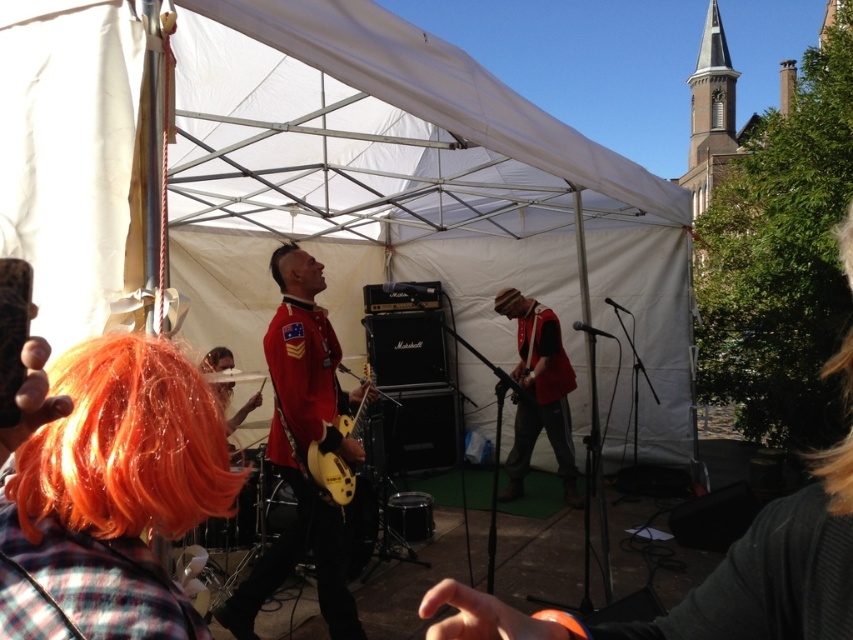
Consider the image. Can you confirm if shiny red uniform at center is positioned to the right of matte red vest at center?

In fact, shiny red uniform at center is to the left of matte red vest at center.

Consider the image. Can you confirm if shiny red uniform at center is thinner than matte red vest at center?

Incorrect, shiny red uniform at center's width is not less than matte red vest at center's.

Between point (322, 564) and point (532, 308), which one is positioned in front?

Point (322, 564)

Image resolution: width=853 pixels, height=640 pixels. Find the location of `shiny red uniform at center`. shiny red uniform at center is located at coordinates (302, 456).

Does orange synthetic wig at lower left have a lesser width compared to dark brown hair at center?

No.

Does orange synthetic wig at lower left have a larger size compared to dark brown hair at center?

Indeed, orange synthetic wig at lower left has a larger size compared to dark brown hair at center.

Is point (177, 442) less distant than point (277, 252)?

That is True.

The width and height of the screenshot is (853, 640). In order to click on orange synthetic wig at lower left in this screenshot , I will do `click(126, 445)`.

Consider the image. Between white fabric tent at center and orange synthetic wig at lower left, which one is positioned lower?

orange synthetic wig at lower left

Which of these two, white fabric tent at center or orange synthetic wig at lower left, stands shorter?

orange synthetic wig at lower left

Measure the distance between white fabric tent at center and camera.

white fabric tent at center and camera are 1.66 meters apart.

Where is `white fabric tent at center`? white fabric tent at center is located at coordinates (409, 193).